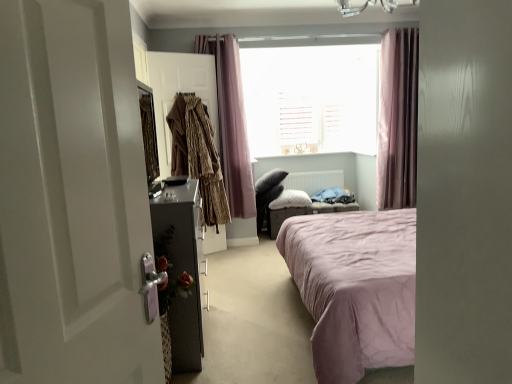
Question: Considering the relative sizes of pink fabric curtain at upper right, positioned as the 2th curtain in left-to-right order, and white glossy door at left in the image provided, is pink fabric curtain at upper right, positioned as the 2th curtain in left-to-right order, taller than white glossy door at left?

Choices:
 (A) yes
 (B) no

Answer: (A)

Question: From the image's perspective, does pink fabric curtain at upper right, positioned as the 2th curtain in left-to-right order, appear lower than white glossy door at left?

Choices:
 (A) no
 (B) yes

Answer: (A)

Question: Is pink fabric curtain at upper right, the first curtain when ordered from right to left, in contact with white glossy door at left?

Choices:
 (A) yes
 (B) no

Answer: (B)

Question: Are pink fabric curtain at upper right, the first curtain when ordered from right to left, and white glossy door at left far apart?

Choices:
 (A) yes
 (B) no

Answer: (A)

Question: Considering the relative positions of pink fabric curtain at upper right, positioned as the 2th curtain in left-to-right order, and white glossy door at left in the image provided, is pink fabric curtain at upper right, positioned as the 2th curtain in left-to-right order, to the left of white glossy door at left from the viewer's perspective?

Choices:
 (A) yes
 (B) no

Answer: (B)

Question: Is pink fabric curtain at upper right, positioned as the 2th curtain in left-to-right order, outside white glossy door at left?

Choices:
 (A) no
 (B) yes

Answer: (B)

Question: Considering the relative positions of pink fabric curtain at upper right, the first curtain when ordered from right to left, and pink fabric curtain at upper center, the 2th curtain viewed from the right, in the image provided, is pink fabric curtain at upper right, the first curtain when ordered from right to left, behind pink fabric curtain at upper center, the 2th curtain viewed from the right,?

Choices:
 (A) yes
 (B) no

Answer: (A)

Question: Would you say pink fabric curtain at upper center, the 2th curtain viewed from the right, is part of pink fabric curtain at upper right, positioned as the 2th curtain in left-to-right order,'s contents?

Choices:
 (A) yes
 (B) no

Answer: (B)

Question: From a real-world perspective, is pink fabric curtain at upper right, positioned as the 2th curtain in left-to-right order, located beneath pink fabric curtain at upper center, which is counted as the 1th curtain, starting from the left?

Choices:
 (A) no
 (B) yes

Answer: (B)

Question: Is pink fabric curtain at upper right, the first curtain when ordered from right to left, wider than pink fabric curtain at upper center, the 2th curtain viewed from the right?

Choices:
 (A) no
 (B) yes

Answer: (B)

Question: Considering the relative sizes of pink fabric curtain at upper right, positioned as the 2th curtain in left-to-right order, and pink fabric curtain at upper center, which is counted as the 1th curtain, starting from the left, in the image provided, is pink fabric curtain at upper right, positioned as the 2th curtain in left-to-right order, shorter than pink fabric curtain at upper center, which is counted as the 1th curtain, starting from the left,?

Choices:
 (A) no
 (B) yes

Answer: (A)

Question: Is pink fabric curtain at upper right, positioned as the 2th curtain in left-to-right order, touching pink fabric curtain at upper center, the 2th curtain viewed from the right?

Choices:
 (A) yes
 (B) no

Answer: (B)

Question: Considering the relative sizes of leopard print coat at left, positioned as the first clothing in right-to-left order, and pink fabric curtain at upper center, which is counted as the 1th curtain, starting from the left, in the image provided, is leopard print coat at left, positioned as the first clothing in right-to-left order, bigger than pink fabric curtain at upper center, which is counted as the 1th curtain, starting from the left,?

Choices:
 (A) no
 (B) yes

Answer: (A)